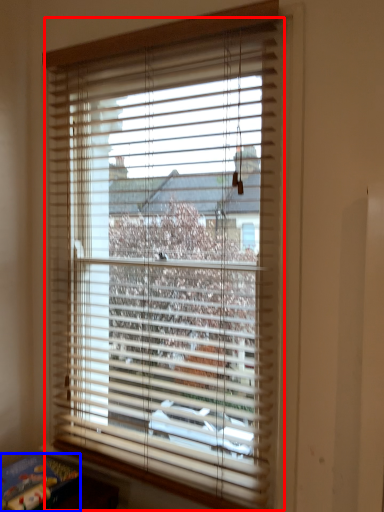
Question: Which of the following is the closest to the observer, window blind (highlighted by a red box) or paperback book (highlighted by a blue box)?

Choices:
 (A) window blind
 (B) paperback book

Answer: (A)